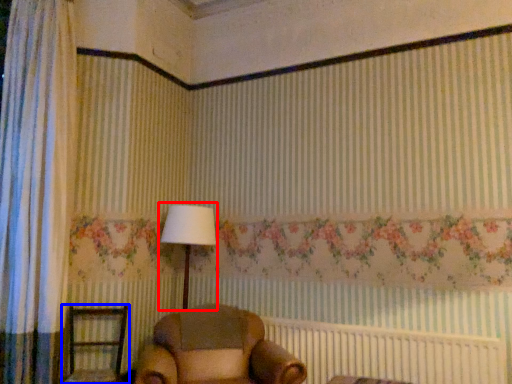
Question: Among these objects, which one is farthest to the camera, table lamp (highlighted by a red box) or furniture (highlighted by a blue box)?

Choices:
 (A) table lamp
 (B) furniture

Answer: (A)